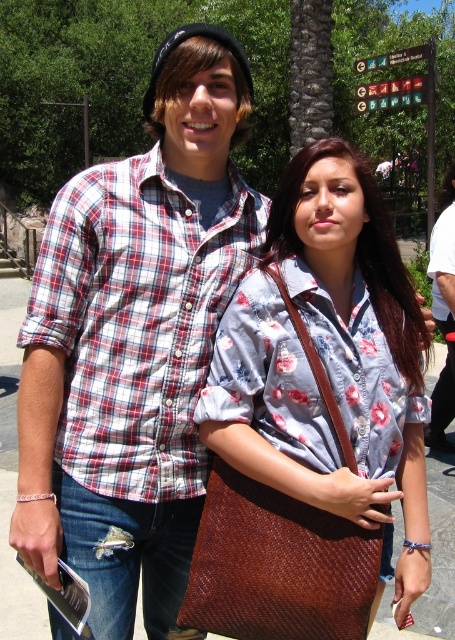
You are a photographer trying to capture the brown woven bag at center in your shot. The camera has a 50mm lens with a field of view of 46 degrees. The bag is located at coordinates 0.569, 0.723. If you want to include both people in the frame without moving the camera, would you need to zoom in or out?

Since the brown woven bag at center is located at coordinates (328,364), you would need to zoom out to include both people in the frame without moving the camera.

You are standing in the park and see two points marked in the image. Which point is nearer to you, point (345, 518) or point (46, 273)?

Point (345, 518) is closer to the viewer than point (46, 273).